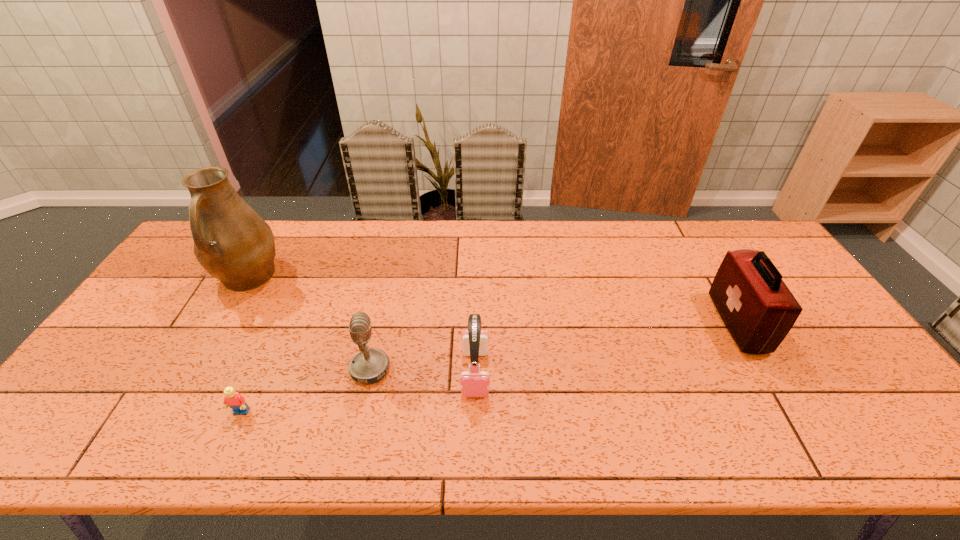
Locate an element on the screen. The width and height of the screenshot is (960, 540). vacant space located on the side of the first aid kit with the cross symbol is located at coordinates [x=678, y=323].

Locate an element on the screen. Image resolution: width=960 pixels, height=540 pixels. free space located 0.270m on the front-facing side of the third object from right to left is located at coordinates (495, 369).

Find the location of a particular element. vacant area located 0.140m on the outer surface of the fourth object from left to right is located at coordinates (474, 454).

Identify the location of free space located 0.070m on the face of the shortest object. This screenshot has height=540, width=960. (226, 447).

The width and height of the screenshot is (960, 540). Find the location of `object situated at the far edge`. object situated at the far edge is located at coordinates (232, 242).

The height and width of the screenshot is (540, 960). Find the location of `object that is at the left edge`. object that is at the left edge is located at coordinates (232, 242).

The height and width of the screenshot is (540, 960). I want to click on object present at the far left corner, so point(232,242).

Locate an element on the screen. free space at the far edge of the desktop is located at coordinates 569,261.

Locate an element on the screen. Image resolution: width=960 pixels, height=540 pixels. free space at the near edge is located at coordinates (400, 424).

Identify the location of vacant space at the left edge of the desktop. Image resolution: width=960 pixels, height=540 pixels. (170, 284).